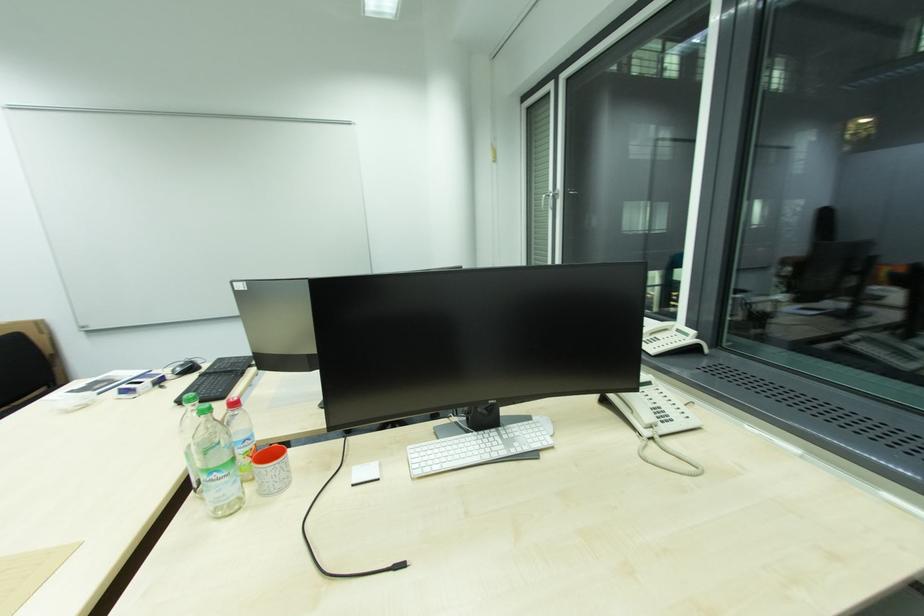
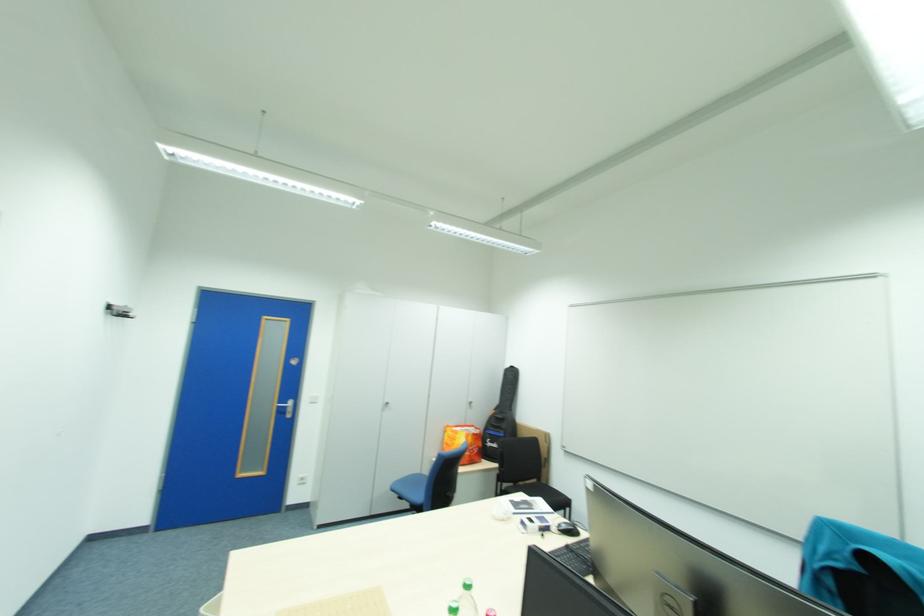
Where in the second image is the point corresponding to point (177, 377) from the first image?

(563, 529)